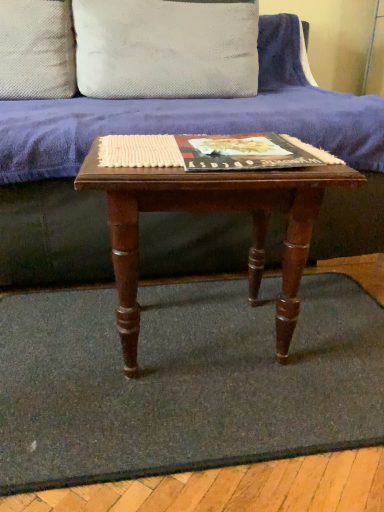
Question: Does matte hardcover book at center turn towards wooden table at center?

Choices:
 (A) no
 (B) yes

Answer: (B)

Question: From the image's perspective, is matte hardcover book at center located beneath wooden table at center?

Choices:
 (A) no
 (B) yes

Answer: (A)

Question: Is matte hardcover book at center not within wooden table at center?

Choices:
 (A) yes
 (B) no

Answer: (B)

Question: From a real-world perspective, does matte hardcover book at center stand above wooden table at center?

Choices:
 (A) yes
 (B) no

Answer: (A)

Question: Is matte hardcover book at center not near wooden table at center?

Choices:
 (A) yes
 (B) no

Answer: (B)

Question: In terms of height, does velvet purple couch at center look taller or shorter compared to gray carpet at center?

Choices:
 (A) tall
 (B) short

Answer: (A)

Question: Based on their positions, is velvet purple couch at center located to the left or right of gray carpet at center?

Choices:
 (A) right
 (B) left

Answer: (B)

Question: Is velvet purple couch at center in front of or behind gray carpet at center in the image?

Choices:
 (A) front
 (B) behind

Answer: (B)

Question: From a real-world perspective, is velvet purple couch at center positioned above or below gray carpet at center?

Choices:
 (A) above
 (B) below

Answer: (A)

Question: Which is correct: matte hardcover book at center is inside wooden table at center, or outside of it?

Choices:
 (A) inside
 (B) outside

Answer: (A)

Question: Looking at their shapes, would you say matte hardcover book at center is wider or thinner than wooden table at center?

Choices:
 (A) thin
 (B) wide

Answer: (A)

Question: Does point click(261, 160) appear closer or farther from the camera than point click(129, 288)?

Choices:
 (A) farther
 (B) closer

Answer: (B)

Question: Considering the relative positions of matte hardcover book at center and wooden table at center in the image provided, is matte hardcover book at center to the left or to the right of wooden table at center?

Choices:
 (A) right
 (B) left

Answer: (A)

Question: Would you say velvet purple couch at center is to the left or to the right of wooden table at center in the picture?

Choices:
 (A) left
 (B) right

Answer: (A)

Question: Considering the positions of velvet purple couch at center and wooden table at center in the image, is velvet purple couch at center taller or shorter than wooden table at center?

Choices:
 (A) tall
 (B) short

Answer: (A)